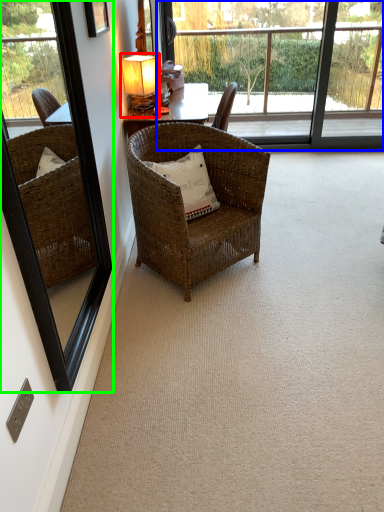
Question: Considering the real-world distances, which object is closest to table lamp (highlighted by a red box)? bay window (highlighted by a blue box) or window frame (highlighted by a green box).

Choices:
 (A) bay window
 (B) window frame

Answer: (B)